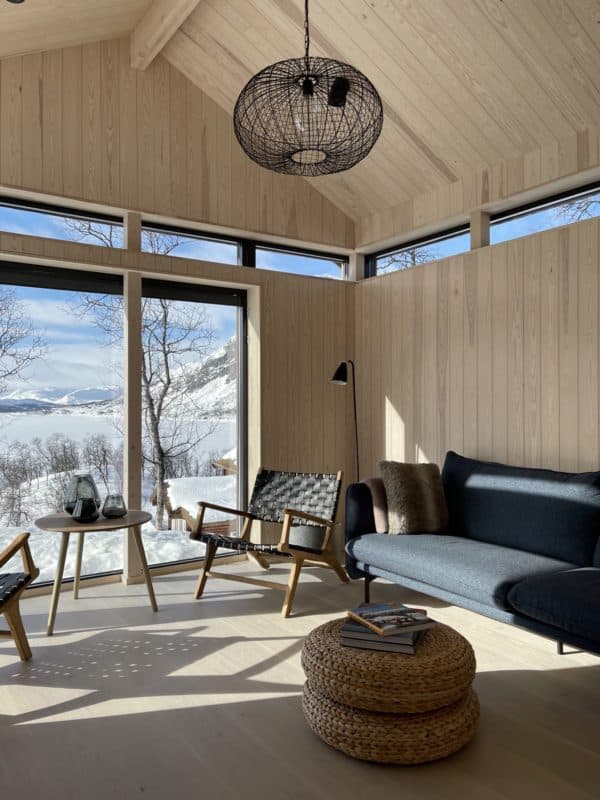
Find the location of a particular element. basket is located at coordinates (413, 692).